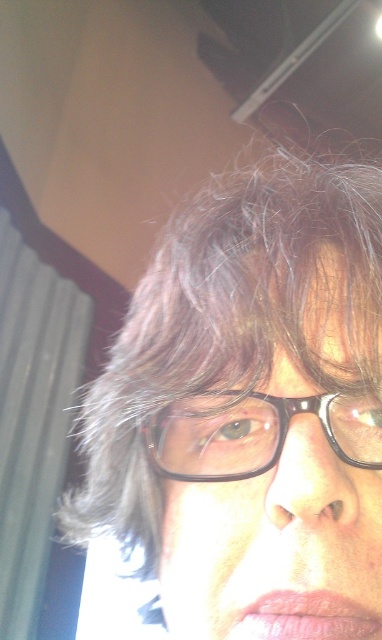
Consider the image. You are trying to take a selfie and want to ensure both the brown matte hair at center and the black plastic glasses at center are visible. Based on their widths, which object should you adjust the camera angle to focus on first?

The brown matte hair at center is wider than the black plastic glasses at center, so you should adjust the camera angle to focus on the brown matte hair at center first to ensure both are visible.

You are taking a closeup selfie indoors and see two points in the image, one at point (131, 305) and another at point (216, 397). Which point is closer to the camera?

Point (131, 305) is further to the camera than point (216, 397), so the closer point to the camera is point (216, 397).

You are taking a selfie and want to ensure your brown matte hair at center and black plastic glasses at center are both visible. Based on their positions, which object is closer to the camera?

The brown matte hair at center is closer to the viewer than the black plastic glasses at center, so the hair will appear closer to the camera in the selfie.